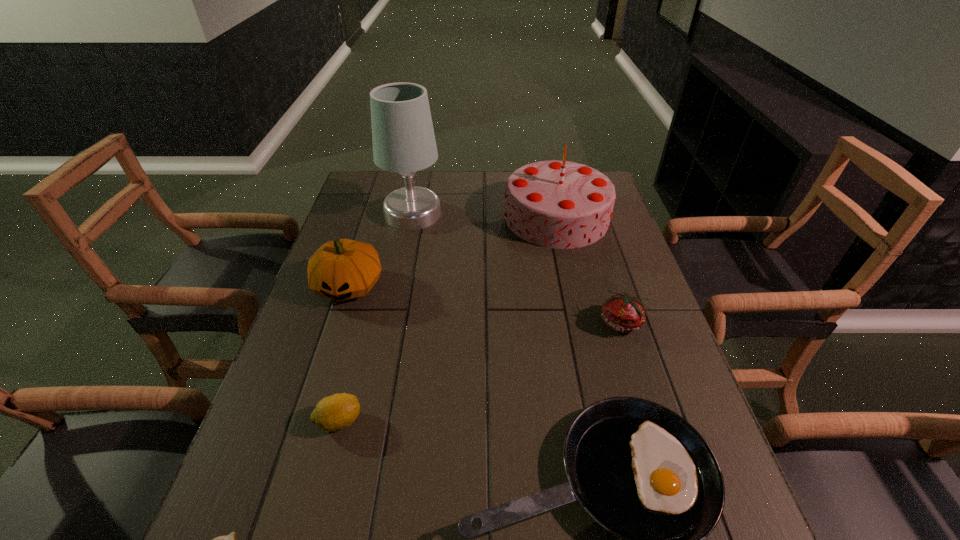
In order to click on vacant space at the far edge in this screenshot , I will do `click(493, 174)`.

Image resolution: width=960 pixels, height=540 pixels. What are the coordinates of `vacant region at the near edge` in the screenshot? It's located at (563, 531).

In the image, there is a desktop. In order to click on blank space at the left edge in this screenshot , I will do `click(355, 342)`.

In the image, there is a desktop. Where is `vacant space at the right edge`? The height and width of the screenshot is (540, 960). vacant space at the right edge is located at coordinates (631, 247).

What are the coordinates of `vacant space at the far left corner of the desktop` in the screenshot? It's located at (359, 197).

Find the location of `vacant point located between the lampshade and the right lemon`. vacant point located between the lampshade and the right lemon is located at coordinates (376, 318).

This screenshot has height=540, width=960. In order to click on free space between the gourd and the fourth tallest object in this screenshot , I will do `click(486, 305)`.

Locate an element on the screen. This screenshot has width=960, height=540. free space that is in between the tomato and the lampshade is located at coordinates [x=517, y=268].

The height and width of the screenshot is (540, 960). I want to click on vacant region between the birthday cake and the right lemon, so click(x=448, y=319).

Locate an element on the screen. The width and height of the screenshot is (960, 540). free space between the third tallest object and the second tallest object is located at coordinates (453, 252).